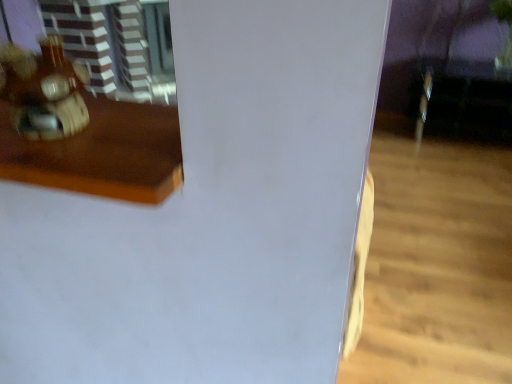
Question: Does wooden toy at left have a smaller size compared to wooden table at left?

Choices:
 (A) no
 (B) yes

Answer: (B)

Question: Is wooden table at left completely or partially inside wooden toy at left?

Choices:
 (A) yes
 (B) no

Answer: (B)

Question: Considering the relative positions of wooden toy at left and wooden table at left in the image provided, is wooden toy at left to the right of wooden table at left from the viewer's perspective?

Choices:
 (A) no
 (B) yes

Answer: (A)

Question: Is wooden toy at left positioned far away from wooden table at left?

Choices:
 (A) no
 (B) yes

Answer: (A)

Question: Is wooden toy at left taller than wooden table at left?

Choices:
 (A) yes
 (B) no

Answer: (A)

Question: From a real-world perspective, is wooden toy at left positioned under wooden table at left based on gravity?

Choices:
 (A) yes
 (B) no

Answer: (B)

Question: Is wooden table at left far from wooden toy at left?

Choices:
 (A) yes
 (B) no

Answer: (B)

Question: Considering the relative positions of wooden table at left and wooden toy at left in the image provided, is wooden table at left in front of wooden toy at left?

Choices:
 (A) yes
 (B) no

Answer: (A)

Question: From a real-world perspective, is wooden table at left located beneath wooden toy at left?

Choices:
 (A) no
 (B) yes

Answer: (B)

Question: Is wooden table at left not inside wooden toy at left?

Choices:
 (A) yes
 (B) no

Answer: (A)

Question: Does wooden table at left appear on the left side of wooden toy at left?

Choices:
 (A) no
 (B) yes

Answer: (A)

Question: Is wooden table at left positioned behind wooden toy at left?

Choices:
 (A) yes
 (B) no

Answer: (B)

Question: From a real-world perspective, relative to wooden table at left, is wooden toy at left vertically above or below?

Choices:
 (A) above
 (B) below

Answer: (A)